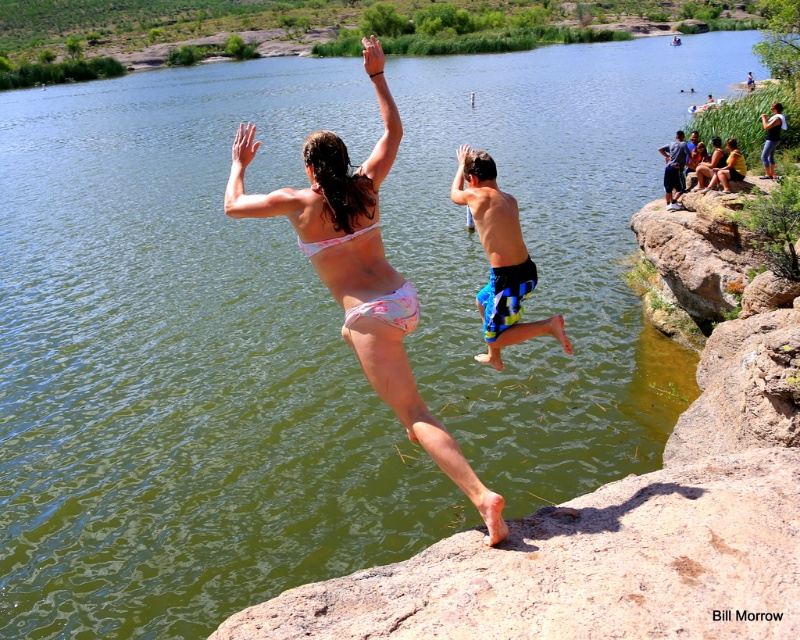
You are standing at the origin point in the image and see the denim shorts at upper right represented by point (772, 138). What is the direction of the denim shorts at upper right relative to your position?

The denim shorts at upper right is located at point (772, 138), which is in the upper right direction from the origin point.

You are standing at the edge of the water body and want to throw a frisbee to a friend who is standing at the location of the denim shorts at upper right. The frisbee can travel up to 15 meters. Will you be able to reach them?

The denim shorts at upper right is 17.02 meters from viewer, so the frisbee cannot reach them since it can only travel up to 15 meters.

You are standing at the point marked at (512,260) and want to jump into the water where the woman in white bikini and the boy in blue swim trunks are leaping from. How far apart are the two people jumping from the point?

The two people are 5.15 meters apart from each other.